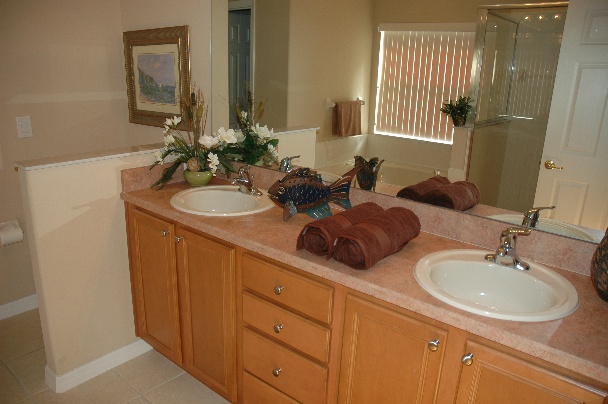
Where is `counter`? The height and width of the screenshot is (404, 608). counter is located at coordinates (406, 273).